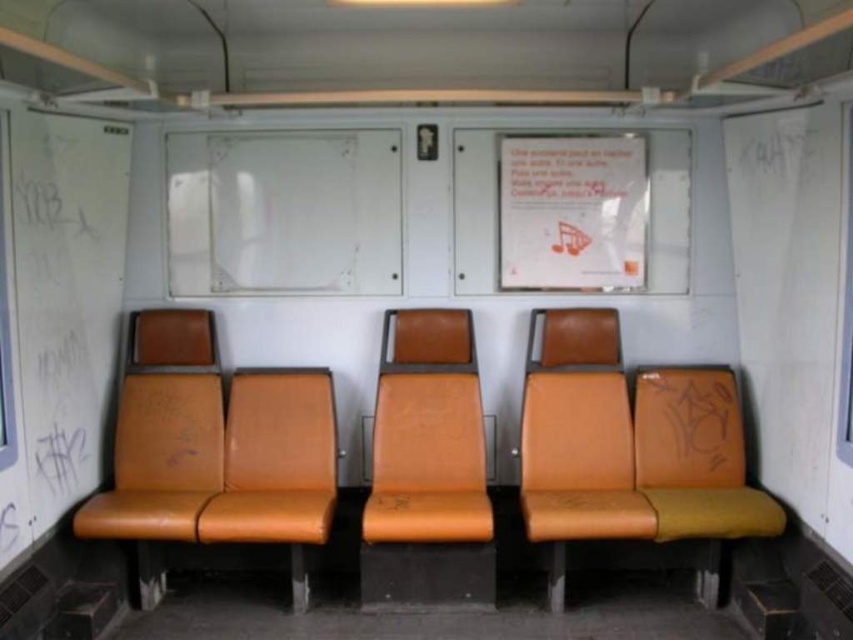
Question: Is leather-like orange seat at left bigger than leather-like orange seat at right?

Choices:
 (A) yes
 (B) no

Answer: (A)

Question: Which point is closer to the camera?

Choices:
 (A) white paper poster at upper center
 (B) orange leather chair at center
 (C) orange leather seat at left

Answer: (C)

Question: Which point is farther to the camera?

Choices:
 (A) (612, 444)
 (B) (656, 397)
 (C) (259, 464)

Answer: (B)

Question: Can you confirm if leather-like orange seat at center is positioned below leather-like orange seat at right?

Choices:
 (A) no
 (B) yes

Answer: (A)

Question: Is leather-like orange seat at left smaller than white paper poster at upper center?

Choices:
 (A) yes
 (B) no

Answer: (B)

Question: Considering the real-world distances, which object is closest to the orange leather seat at left?

Choices:
 (A) orange leather chair at center
 (B) leather-like orange seat at center

Answer: (A)